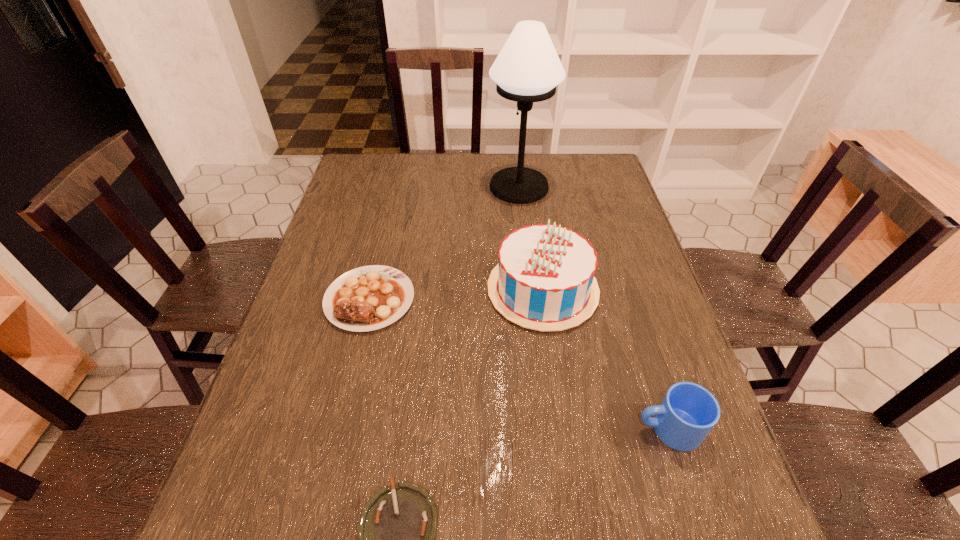
You are a GUI agent. You are given a task and a screenshot of the screen. Output one action in this format:
    pyautogui.click(x=<x>, y=<y>)
    Task: Click on the unoccupied position between the rightmost object and the steak
    This screenshot has width=960, height=540.
    Given the screenshot: What is the action you would take?
    pyautogui.click(x=519, y=364)

This screenshot has height=540, width=960. I want to click on free space between the birthday cake and the rightmost object, so click(x=606, y=359).

At what (x,y) coordinates should I click in order to perform the action: click on free space between the steak and the tallest object. Please return your answer as a coordinate pair (x, y). The image size is (960, 540). Looking at the image, I should click on (444, 243).

Locate an element on the screen. The image size is (960, 540). free point between the steak and the rightmost object is located at coordinates (519, 364).

The height and width of the screenshot is (540, 960). In order to click on object identified as the second closest to the farthest object in this screenshot , I will do `click(368, 298)`.

Image resolution: width=960 pixels, height=540 pixels. Find the location of `object that can be found as the second closest to the birthday cake`. object that can be found as the second closest to the birthday cake is located at coordinates (688, 412).

The image size is (960, 540). Find the location of `free space that satisfies the following two spatial constraints: 1. on the back side of the steak; 2. on the left side of the tallest object`. free space that satisfies the following two spatial constraints: 1. on the back side of the steak; 2. on the left side of the tallest object is located at coordinates (396, 187).

You are a GUI agent. You are given a task and a screenshot of the screen. Output one action in this format:
    pyautogui.click(x=<x>, y=<y>)
    Task: Click on the free space that satisfies the following two spatial constraints: 1. on the front side of the second tallest object; 2. on the left side of the table lamp
    
    Given the screenshot: What is the action you would take?
    pyautogui.click(x=531, y=290)